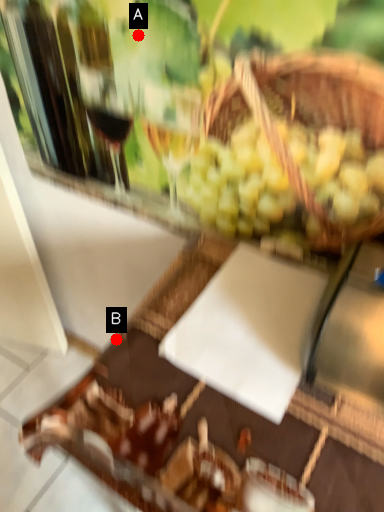
Question: Two points are circled on the image, labeled by A and B beside each circle. Which point is further to the camera?

Choices:
 (A) A is further
 (B) B is further

Answer: (B)